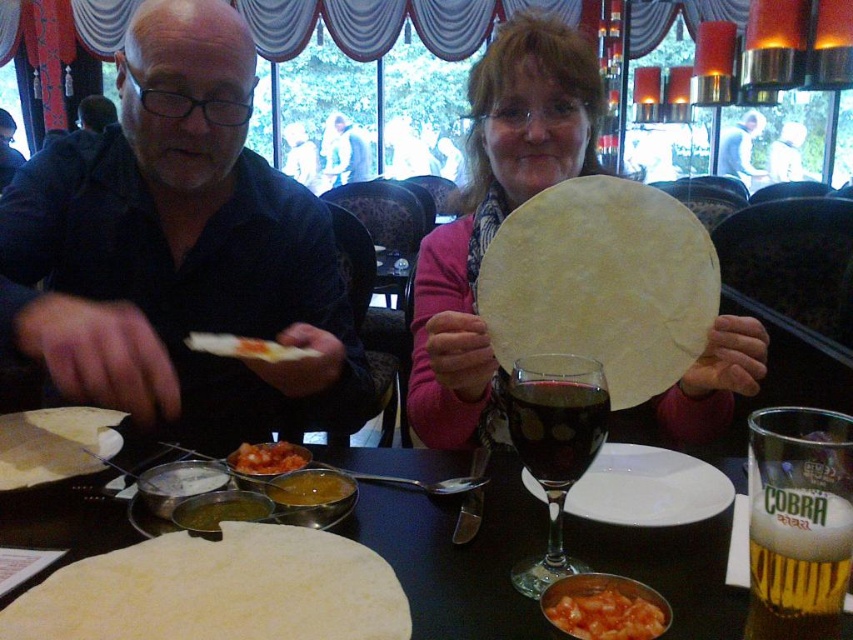
Describe the element at coordinates (309, 486) in the screenshot. I see `yellow creamy sauce at center` at that location.

Is point (299, 480) more distant than point (728, 129)?

No, (299, 480) is closer to viewer.

Measure the distance between point (347, 490) and camera.

Point (347, 490) is 32.30 inches away from camera.

You are a GUI agent. You are given a task and a screenshot of the screen. Output one action in this format:
    pyautogui.click(x=<x>, y=<y>)
    Task: Click on the yellow creamy sauce at center
    This screenshot has height=640, width=853.
    Given the screenshot: What is the action you would take?
    pyautogui.click(x=309, y=486)

Between transparent glass wine glass at center and white soft bread at center, which one is positioned higher?

white soft bread at center is higher up.

From the picture: Which is more to the left, transparent glass wine glass at center or white soft bread at center?

Positioned to the left is white soft bread at center.

The image size is (853, 640). Find the location of `transparent glass wine glass at center`. transparent glass wine glass at center is located at coordinates (554, 445).

Can you confirm if white matte tortilla at center is shorter than yellow matte tortilla at lower left?

No, white matte tortilla at center is not shorter than yellow matte tortilla at lower left.

Identify the location of white matte tortilla at center. This screenshot has width=853, height=640. (457, 556).